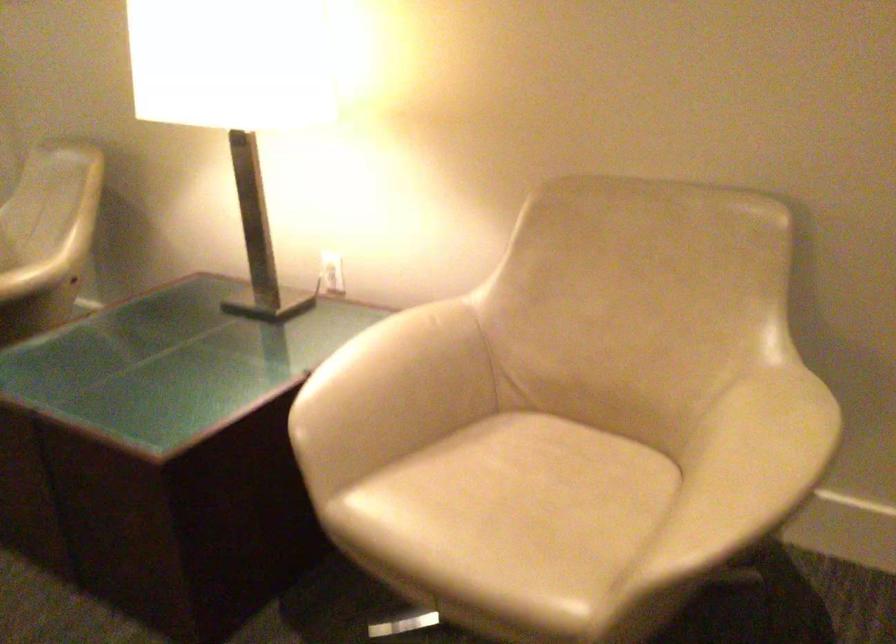
What do you see at coordinates (332, 272) in the screenshot? This screenshot has height=644, width=896. I see `a white electrical outlet` at bounding box center [332, 272].